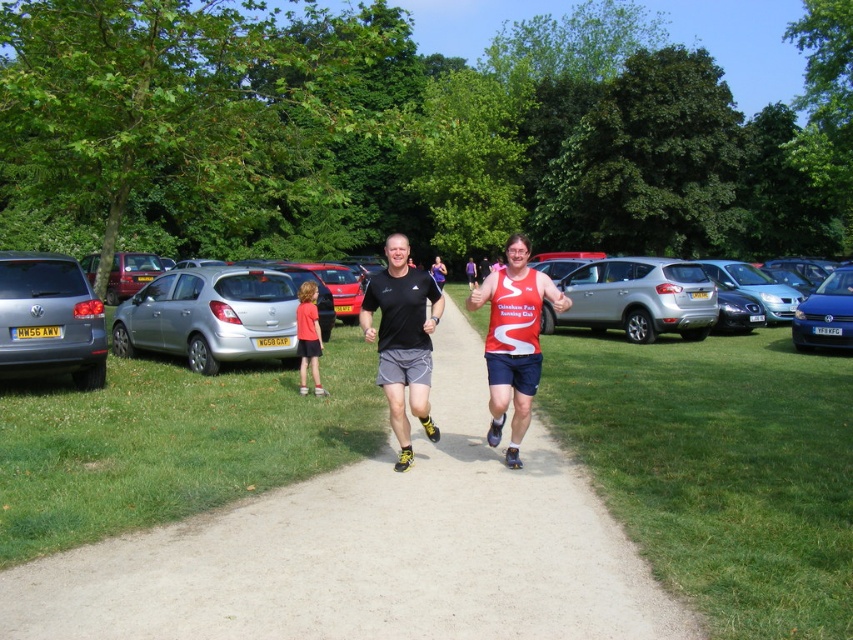
Question: Is blue metallic hatchback at right above silver metallic hatchback at right?

Choices:
 (A) yes
 (B) no

Answer: (A)

Question: Which is farther from the silver metallic hatchback at right?

Choices:
 (A) matte silver car at left
 (B) red matte running shirt at center
 (C) black matte running shoes at center

Answer: (A)

Question: Which object is the farthest from the black matte running shoes at center?

Choices:
 (A) red matte running shirt at center
 (B) silver metallic hatchback at center-left
 (C) smooth concrete path at center

Answer: (B)

Question: Estimate the real-world distances between objects in this image. Which object is farther from the silver metallic suv at center-right?

Choices:
 (A) silver metallic hatchback at right
 (B) silver metallic hatchback at center-left

Answer: (B)

Question: Does silver metallic hatchback at center-left lie behind black matte running shoes at center?

Choices:
 (A) yes
 (B) no

Answer: (A)

Question: Can you confirm if smooth concrete path at center is bigger than silver metallic suv at center-right?

Choices:
 (A) no
 (B) yes

Answer: (A)